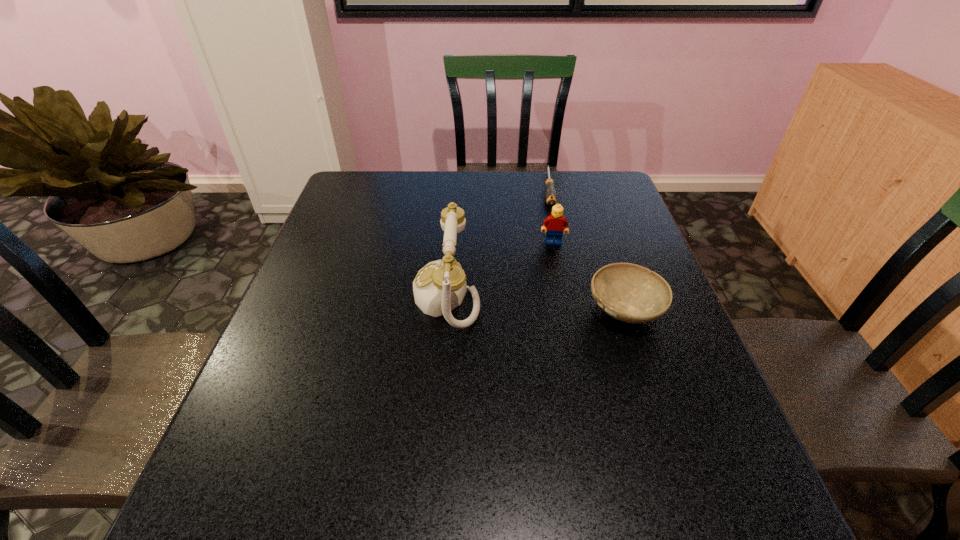
At what (x,y) coordinates should I click in order to perform the action: click on free space at the far edge of the desktop. Please return your answer as a coordinate pair (x, y). Looking at the image, I should click on (445, 174).

Where is `vacant area at the right edge`? vacant area at the right edge is located at coordinates (692, 366).

Where is `vacant space at the far left corner of the desktop`? vacant space at the far left corner of the desktop is located at coordinates (344, 209).

The width and height of the screenshot is (960, 540). Identify the location of free region at the near left corner of the desktop. (274, 429).

In the image, there is a desktop. Where is `vacant space at the far right corner`? The image size is (960, 540). vacant space at the far right corner is located at coordinates (583, 204).

This screenshot has width=960, height=540. Identify the location of free space that is in between the third tallest object and the farthest object. (587, 248).

Where is `free space between the third shortest object and the rightmost object`? free space between the third shortest object and the rightmost object is located at coordinates (589, 275).

Locate an element on the screen. Image resolution: width=960 pixels, height=540 pixels. vacant space that's between the leftmost object and the bowl is located at coordinates (536, 302).

The height and width of the screenshot is (540, 960). Find the location of `free area in between the third nearest object and the tallest object`. free area in between the third nearest object and the tallest object is located at coordinates (500, 268).

Where is `free space between the rightmost object and the third nearest object`? free space between the rightmost object and the third nearest object is located at coordinates point(589,275).